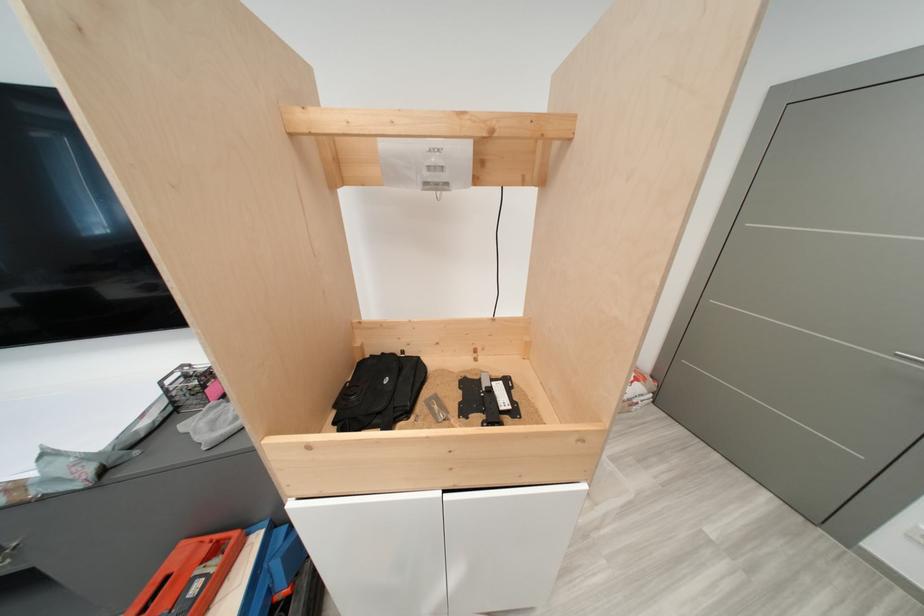
Image resolution: width=924 pixels, height=616 pixels. What are the coordinates of `grey door handle` in the screenshot? It's located at (909, 349).